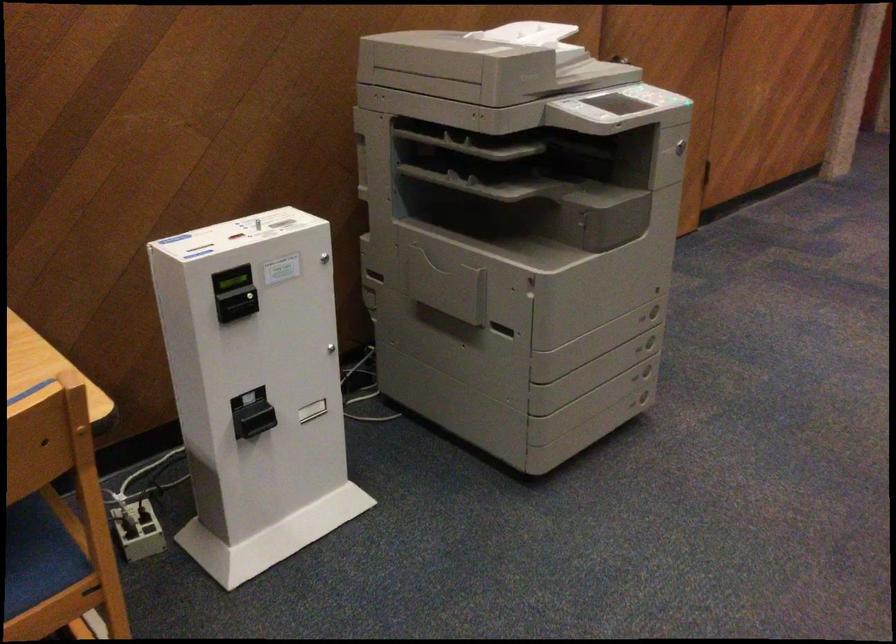
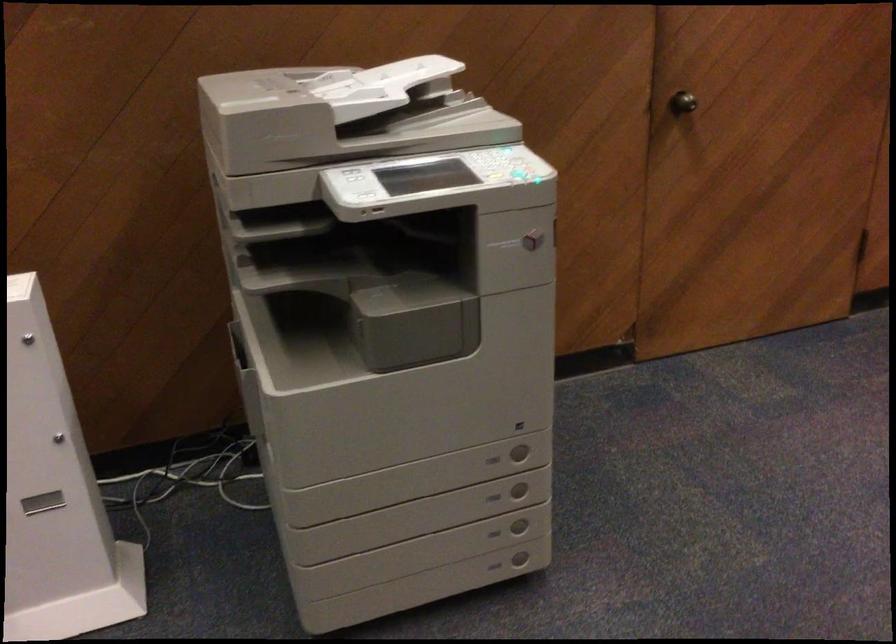
Where in the second image is the point corresponding to pixel 648 372 from the first image?

(519, 527)